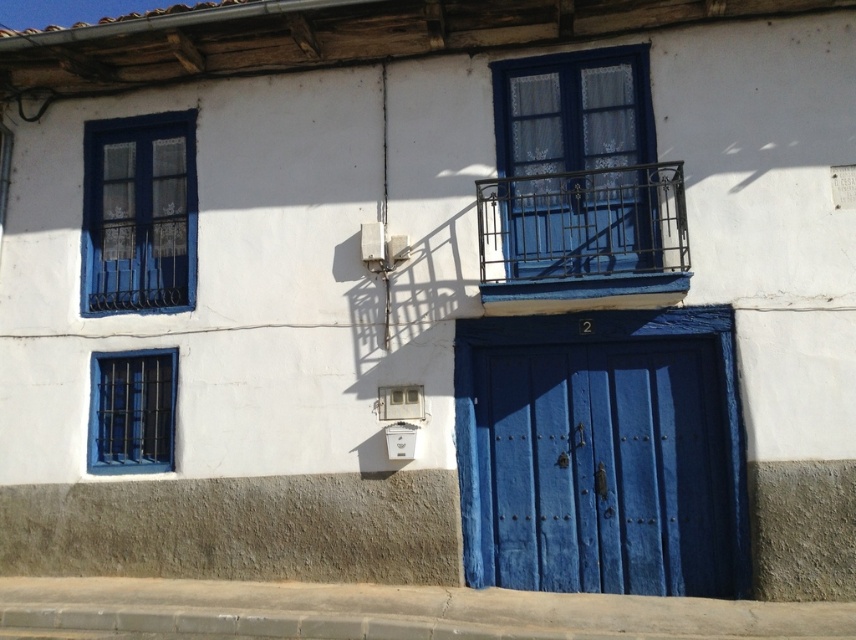
Does blue wooden door at center have a lesser width compared to matte blue window at lower left?

Incorrect, blue wooden door at center's width is not less than matte blue window at lower left's.

Does point (693, 442) lie behind point (170, 348)?

No, (693, 442) is closer to viewer.

At what (x,y) coordinates should I click in order to perform the action: click on blue wooden door at center. Please return your answer as a coordinate pair (x, y). Looking at the image, I should click on (605, 467).

Between point (514, 522) and point (581, 61), which one is positioned behind?

The point (581, 61) is behind.

Is blue wooden door at center thinner than blue glass window at upper center?

No.

Who is more distant from viewer, (631,568) or (597,141)?

Positioned behind is point (597,141).

The width and height of the screenshot is (856, 640). Identify the location of blue wooden door at center. (605, 467).

Can you confirm if matte blue window at upper left is smaller than matte blue window at lower left?

Incorrect, matte blue window at upper left is not smaller in size than matte blue window at lower left.

Is matte blue window at upper left to the left of matte blue window at lower left from the viewer's perspective?

Correct, you'll find matte blue window at upper left to the left of matte blue window at lower left.

Does point (135, 161) lie behind point (107, 458)?

That is True.

The width and height of the screenshot is (856, 640). What are the coordinates of `matte blue window at upper left` in the screenshot? It's located at (140, 214).